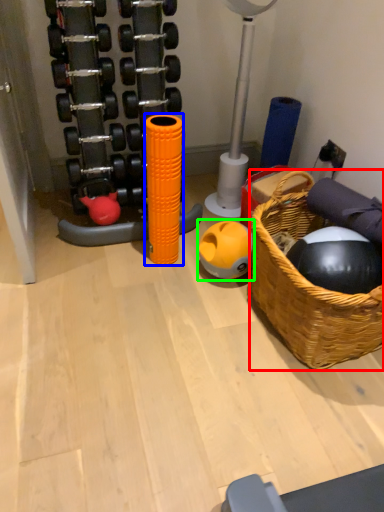
Question: Considering the real-world distances, which object is farthest from basket (highlighted by a red box)? toy (highlighted by a blue box) or ball (highlighted by a green box)?

Choices:
 (A) toy
 (B) ball

Answer: (A)